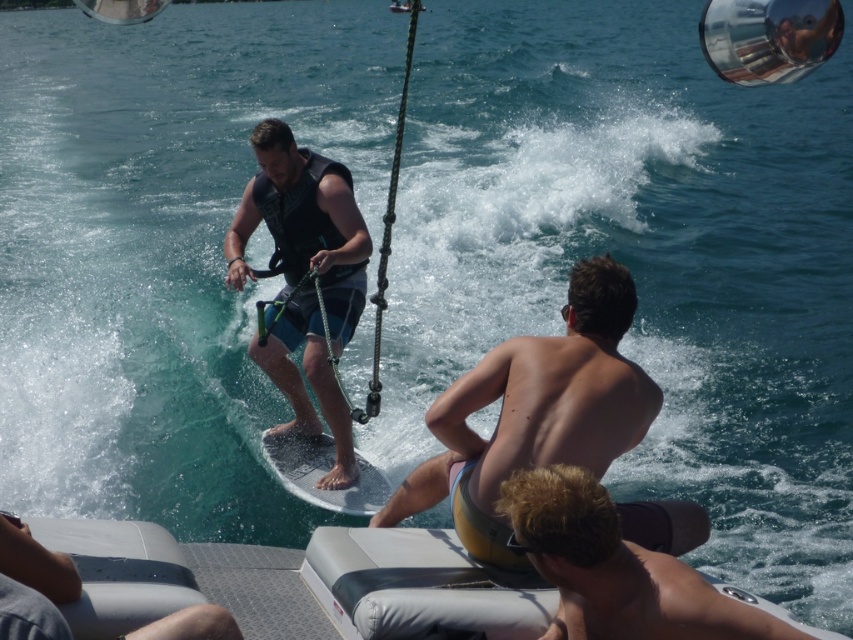
Question: Among these objects, which one is farthest from the camera?

Choices:
 (A) dark blue fabric life vest at center
 (B) white glossy water ski at center

Answer: (A)

Question: Is dark blue fabric life vest at center above blonde hair at lower right?

Choices:
 (A) yes
 (B) no

Answer: (A)

Question: Is dark blue fabric life vest at center above blonde hair at lower right?

Choices:
 (A) yes
 (B) no

Answer: (A)

Question: Is smooth skin torso at center smaller than gray fabric cushion at lower left?

Choices:
 (A) yes
 (B) no

Answer: (B)

Question: Considering the real-world distances, which object is closest to the smooth skin torso at center?

Choices:
 (A) dark blue fabric life vest at center
 (B) gray fabric cushion at lower left
 (C) white glossy water ski at center
 (D) blonde hair at lower right

Answer: (D)

Question: Which point appears closest to the camera in this image?

Choices:
 (A) (55, 580)
 (B) (473, 397)
 (C) (282, 476)

Answer: (A)